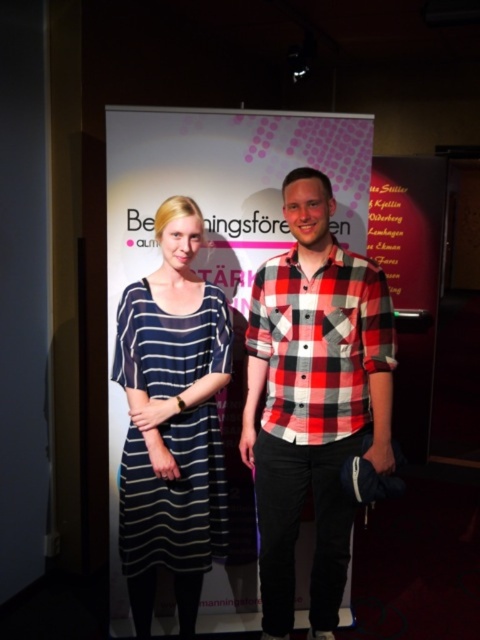
Does red plaid shirt at center appear on the right side of navy striped dress at center?

Correct, you'll find red plaid shirt at center to the right of navy striped dress at center.

Locate an element on the screen. red plaid shirt at center is located at coordinates (313, 400).

Who is taller, red plaid shirt at center or red checkered shirt at center?

With more height is red plaid shirt at center.

Is point (325, 182) behind point (333, 289)?

No, (325, 182) is in front of (333, 289).

Who is more distant from viewer, (264, 278) or (260, 282)?

The point (260, 282) is more distant.

You are a GUI agent. You are given a task and a screenshot of the screen. Output one action in this format:
    pyautogui.click(x=<x>, y=<y>)
    Task: Click on the red plaid shirt at center
    
    Given the screenshot: What is the action you would take?
    pyautogui.click(x=313, y=400)

Consider the image. Can you confirm if navy striped dress at center is thinner than red checkered shirt at center?

Yes, navy striped dress at center is thinner than red checkered shirt at center.

What are the coordinates of `navy striped dress at center` in the screenshot? It's located at (175, 497).

This screenshot has height=640, width=480. I want to click on navy striped dress at center, so click(175, 497).